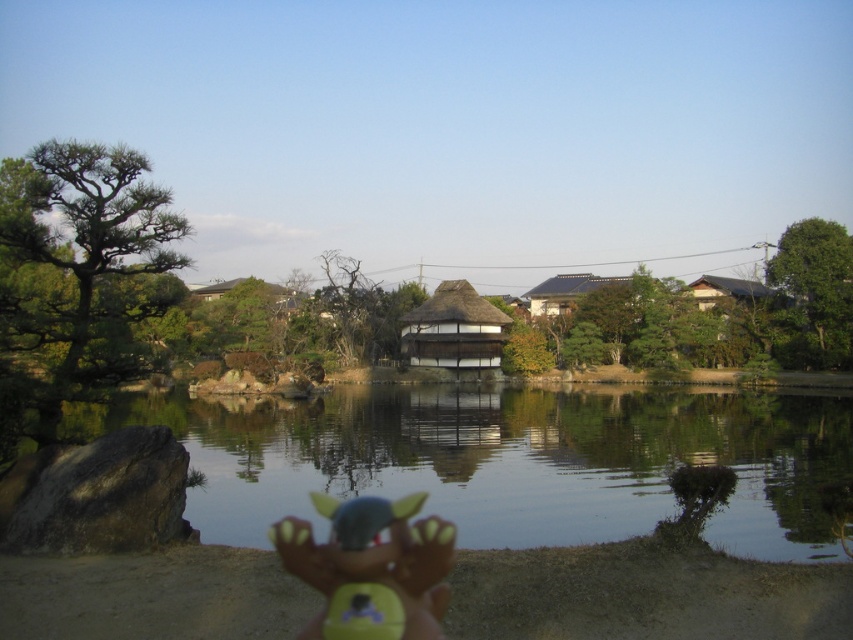
Who is more forward, (759,502) or (730,280)?

Point (759,502)

Does transparent water at center appear on the left side of brown wooden hut at upper right?

Correct, you'll find transparent water at center to the left of brown wooden hut at upper right.

Where is `transparent water at center`? This screenshot has width=853, height=640. transparent water at center is located at coordinates (514, 460).

Image resolution: width=853 pixels, height=640 pixels. Identify the location of transparent water at center. (514, 460).

In the scene shown: Is plush green toy at lower center shorter than brown wooden hut at upper right?

Correct, plush green toy at lower center is not as tall as brown wooden hut at upper right.

Where is `plush green toy at lower center`? The height and width of the screenshot is (640, 853). plush green toy at lower center is located at coordinates (370, 566).

Does thatched roof hut at center appear over brown wooden hut at upper right?

Actually, thatched roof hut at center is below brown wooden hut at upper right.

Is thatched roof hut at center in front of brown wooden hut at upper right?

That is False.

Is point (479, 308) positioned behind point (759, 291)?

That is False.

This screenshot has width=853, height=640. Identify the location of thatched roof hut at center. (453, 330).